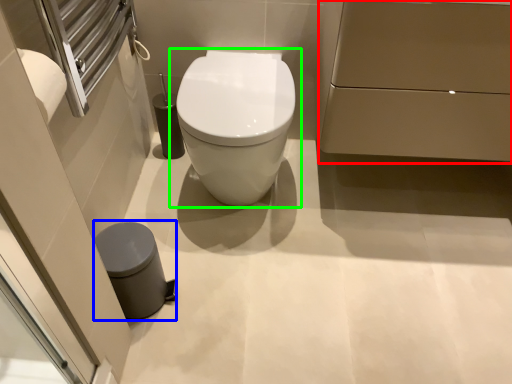
Question: Which is farther away from porcelain (highlighted by a red box)? porcelain (highlighted by a blue box) or toilet (highlighted by a green box)?

Choices:
 (A) porcelain
 (B) toilet

Answer: (A)